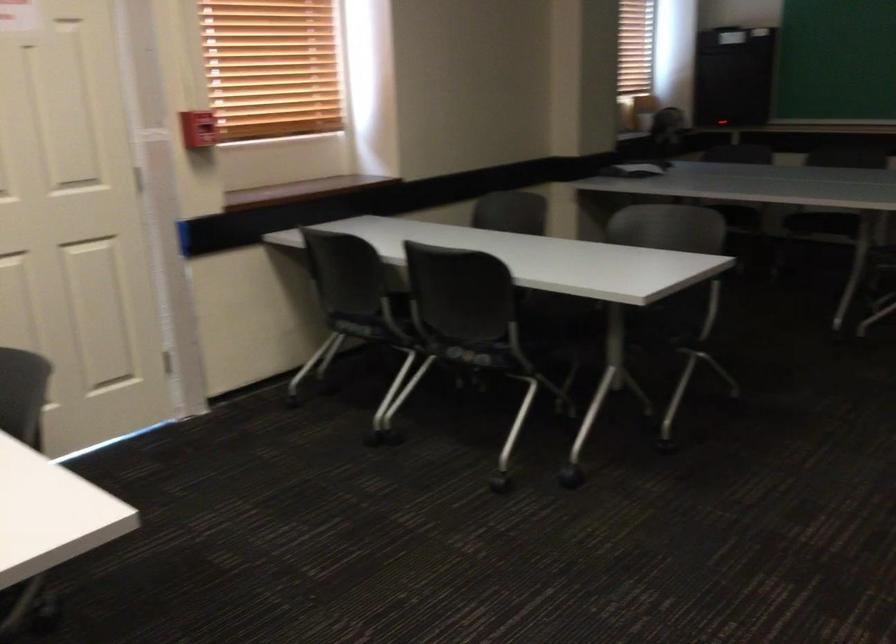
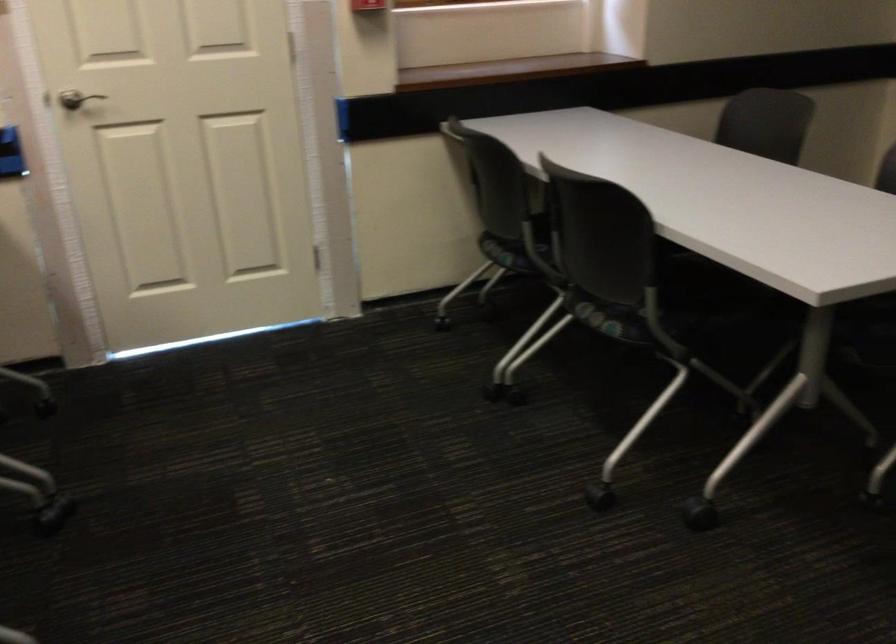
Question: The camera is either moving clockwise (left) or counter-clockwise (right) around the object. The first image is from the beginning of the video and the second image is from the end. Is the camera moving left or right when shooting the video?

Choices:
 (A) Left
 (B) Right

Answer: (B)